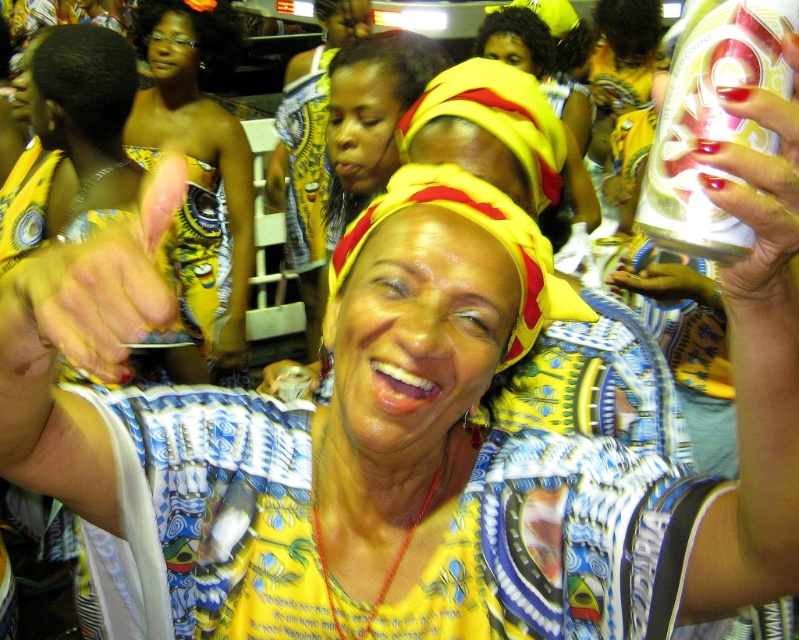
In the scene shown: You are an event planner organizing a photo shoot for a cultural festival. You need to ensure that the headwear items are correctly positioned for the main photo. Which of the two items, the matte yellow headscarf at upper center or the yellow fabric headband at center, should be placed in a position where size matters for visibility?

The yellow fabric headband at center should be placed in the position where size matters for visibility because the matte yellow headscarf at upper center has a smaller size compared to it.

You are an artist trying to sketch this festive scene. You want to ensure the silver metallic can at upper right and the matte yellow headscarf at upper center are proportionally accurate. Which object should you draw smaller in your sketch?

The silver metallic can at upper right should be drawn smaller because it is not as tall as the matte yellow headscarf at upper center.

You are standing at the point labeled as point (x=674, y=56) in the image. You want to move to a safe area 100 centimeters away from where you are currently standing. Can you reach that safe area without moving more than 100 centimeters?

The point labeled as point (x=674, y=56) is 64.32 centimeters away from the viewer. Since 64.32 centimeters is less than 100 centimeters, you can move to the safe area without exceeding the 100 centimeter limit.